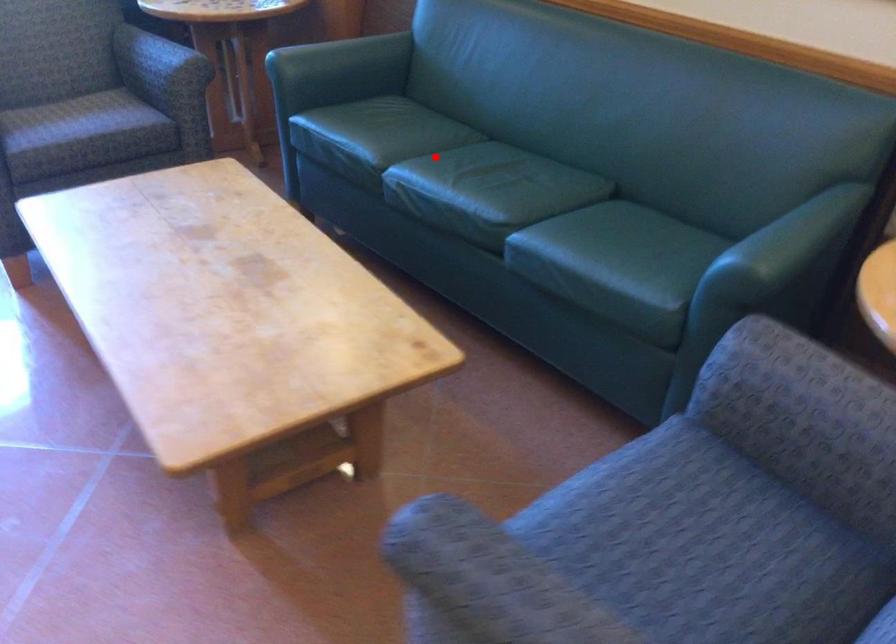
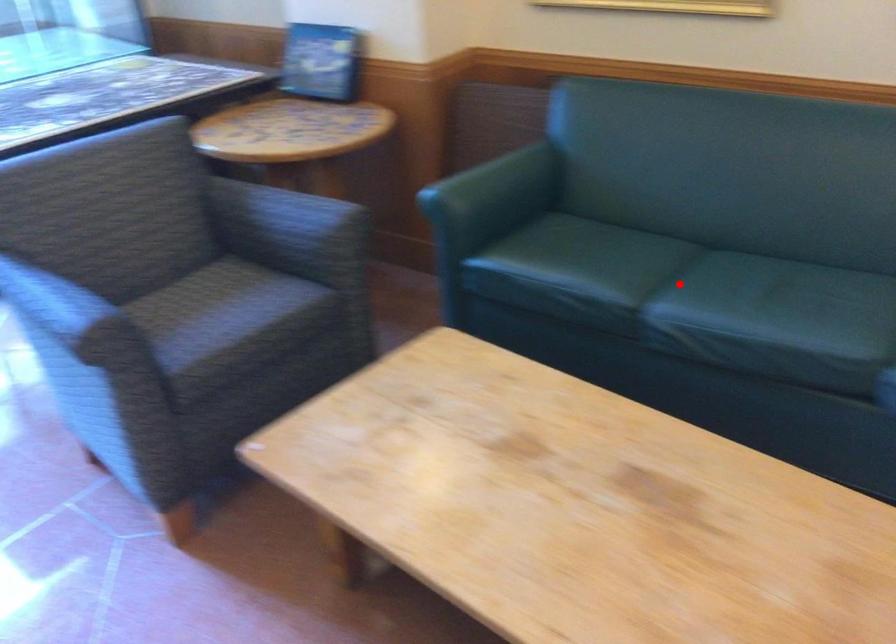
I am providing you with two images of the same scene from different viewpoints. A red point is marked on the first image and another point is marked on the second image. Are the points marked in image1 and image2 representing the same 3D position?

Yes